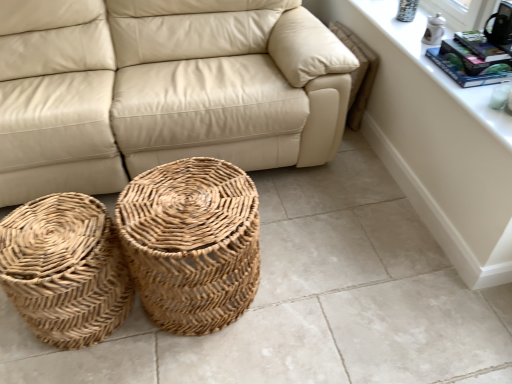
Question: From the image's perspective, is beige leather couch at center located above or below white glossy dresser at upper right?

Choices:
 (A) below
 (B) above

Answer: (B)

Question: In terms of height, does beige leather couch at center look taller or shorter compared to white glossy dresser at upper right?

Choices:
 (A) tall
 (B) short

Answer: (A)

Question: Based on their relative distances, which object is nearer to the white ceramic window sill at upper right?

Choices:
 (A) beige leather couch at center
 (B) white glossy dresser at upper right
 (C) natural woven basket at lower left, the second basket from the right
 (D) natural woven basket at center, which appears as the 1th basket when viewed from the right

Answer: (B)

Question: Estimate the real-world distances between objects in this image. Which object is farther from the white glossy dresser at upper right?

Choices:
 (A) natural woven basket at center, which is counted as the 2th basket, starting from the left
 (B) white ceramic window sill at upper right
 (C) beige leather couch at center
 (D) natural woven basket at lower left, the second basket from the right

Answer: (D)